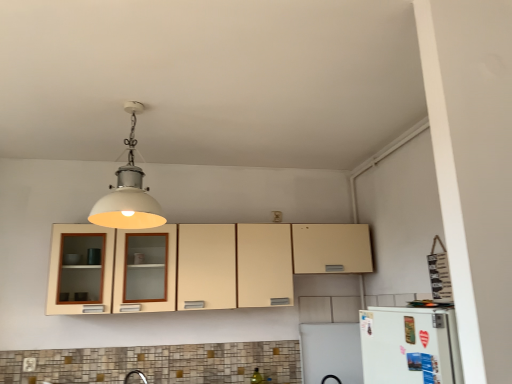
Question: Considering their positions, is white matte light fixture at upper center located in front of or behind beige matte cabinet at center?

Choices:
 (A) front
 (B) behind

Answer: (A)

Question: Considering the positions of white matte light fixture at upper center and beige matte cabinet at center in the image, is white matte light fixture at upper center bigger or smaller than beige matte cabinet at center?

Choices:
 (A) big
 (B) small

Answer: (B)

Question: Estimate the real-world distances between objects in this image. Which object is closer to the beige matte cabinet at center?

Choices:
 (A) matte white electric outlet at lower left
 (B) white matte refrigerator at lower right
 (C) white matte light fixture at upper center

Answer: (C)

Question: Which object is positioned farthest from the white matte light fixture at upper center?

Choices:
 (A) white matte refrigerator at lower right
 (B) beige matte cabinet at center
 (C) matte white electric outlet at lower left

Answer: (C)